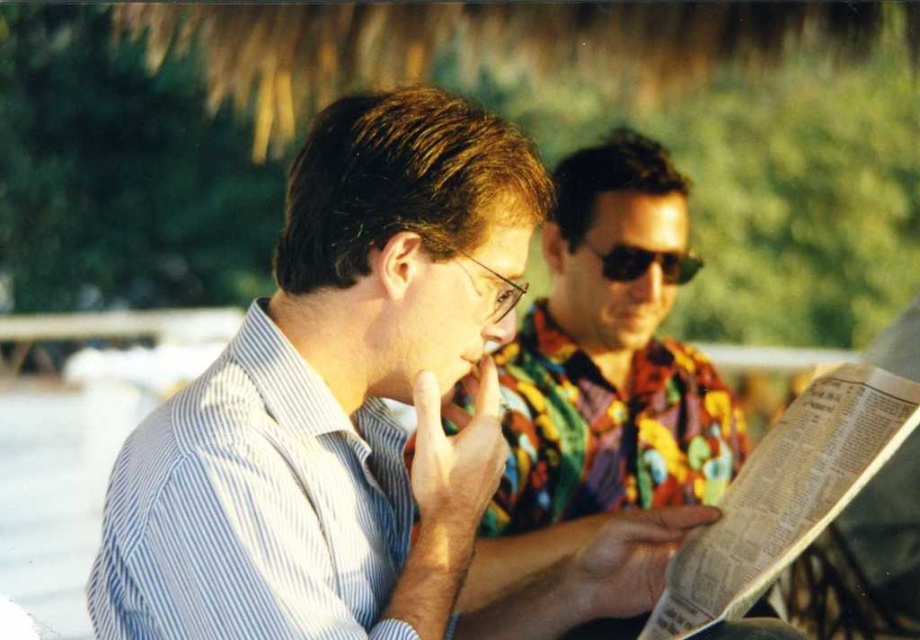
You are standing in the park and see two people. One is wearing a light blue striped shirt at center and the other is wearing a white striped shirt at left. Which person is closer to you?

The light blue striped shirt at center is closer to you because it is further to the viewer than the white striped shirt at left.

You are designing a fashion catalog and need to place the white striped shirt at left and the shiny black sunglasses at center in a layout. Which item should be placed first if you want to arrange them from largest to smallest?

The white striped shirt at left should be placed first because it has a larger size compared to the shiny black sunglasses at center.